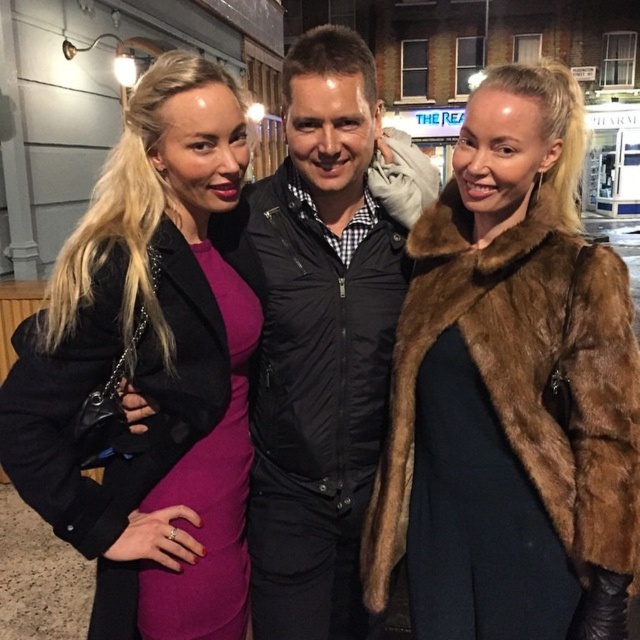
You are a photographer setting up a tripod at position point 0.5, 0.5. You need to ensure that both the matte black coat at left and the other person in the scene are visible in your shot. Which direction should you adjust the tripod to include both subjects?

The matte black coat at left is located at point [150,365]. To include both subjects in the shot, adjust the tripod slightly to the left and upwards to frame both the matte black coat at left and the other person.

You are a fashion blogger analyzing the outfits in the image. You notice the matte black coat at left and the black quilted jacket at center. Which of these two items appears to be smaller in size?

The matte black coat at left has a smaller size compared to the black quilted jacket at center, so the matte black coat at left appears to be smaller in size.

You are a photographer trying to capture a clear shot of both the black quilted jacket at center and the brown fur coat at right. Based on their positions, which one is closer to the camera?

The black quilted jacket at center is closer to the camera than the brown fur coat at right, which is positioned behind it.